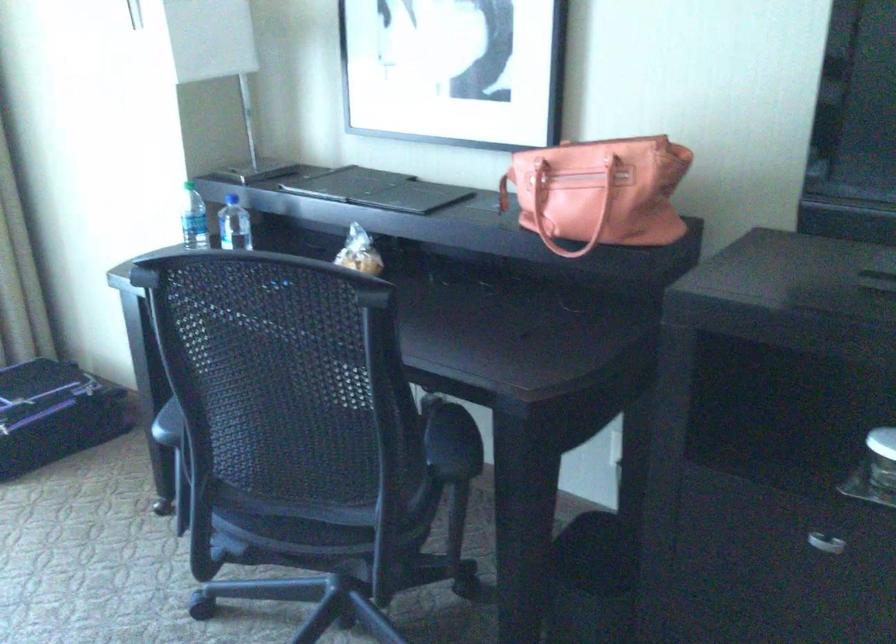
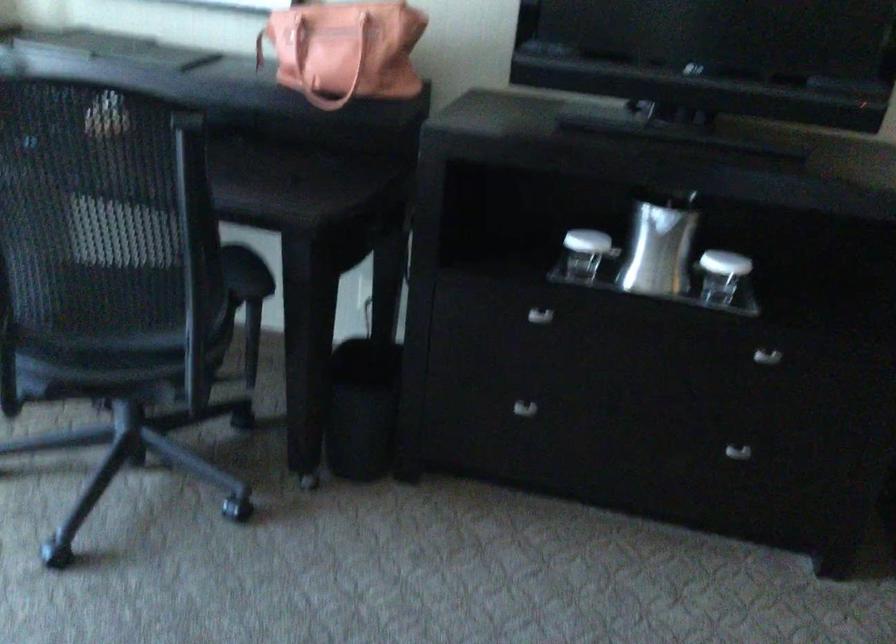
Where in the second image is the point corresponding to [556,199] from the first image?

(315, 57)